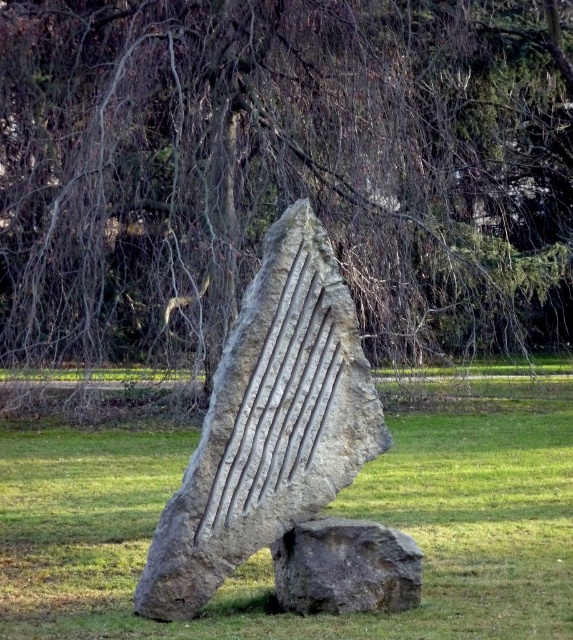
Question: Is bare branches at center wider than natural stone sculpture at center?

Choices:
 (A) yes
 (B) no

Answer: (B)

Question: Which point is closer to the camera taking this photo?

Choices:
 (A) (268, 532)
 (B) (304, 192)
 (C) (401, 540)

Answer: (A)

Question: Is the position of gray stone sculpture at center less distant than that of gray rough rock at lower center?

Choices:
 (A) no
 (B) yes

Answer: (B)

Question: Which object is closer to the camera taking this photo?

Choices:
 (A) gray stone sculpture at center
 (B) bare branches at center

Answer: (A)

Question: Which point is farther from the camera taking this photo?

Choices:
 (A) (249, 420)
 (B) (304, 577)
 (C) (66, 458)
 (D) (429, 140)

Answer: (D)

Question: Can you confirm if natural stone sculpture at center is bigger than gray stone sculpture at center?

Choices:
 (A) yes
 (B) no

Answer: (A)